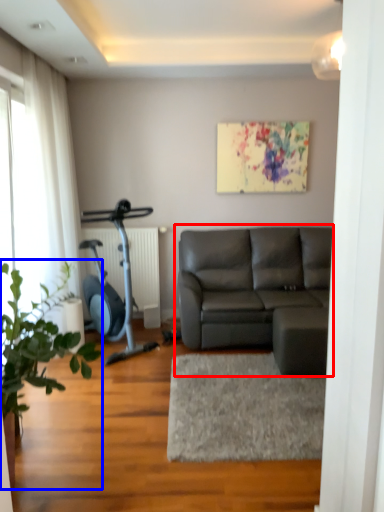
Question: Which object appears closest to the camera in this image, studio couch (highlighted by a red box) or houseplant (highlighted by a blue box)?

Choices:
 (A) studio couch
 (B) houseplant

Answer: (B)